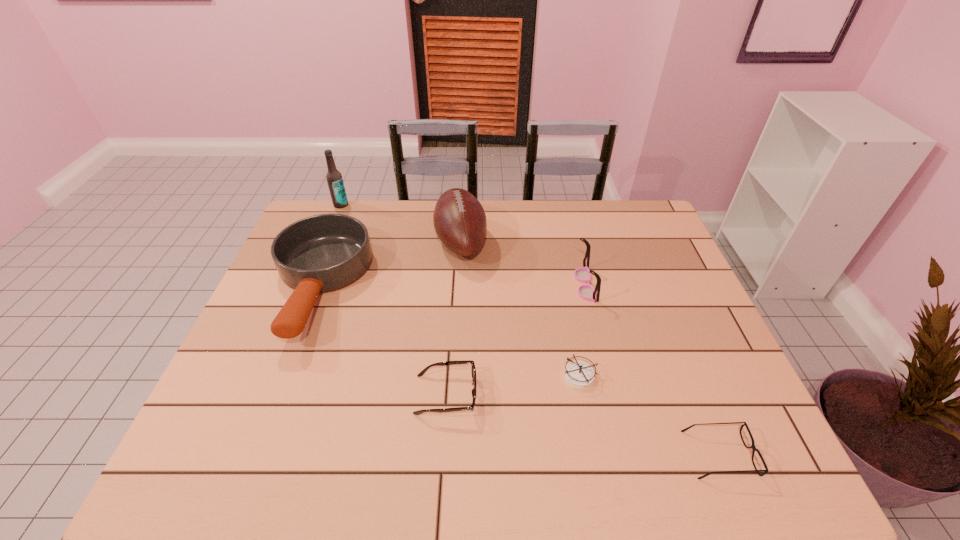
The image size is (960, 540). Find the location of `vacant space at the near edge`. vacant space at the near edge is located at coordinates point(310,449).

Find the location of `vacant area at the right edge of the desktop`. vacant area at the right edge of the desktop is located at coordinates (712, 426).

In the image, there is a desktop. Where is `vacant space at the near left corner`? vacant space at the near left corner is located at coordinates (232, 453).

At what (x,y) coordinates should I click in order to perform the action: click on vacant space at the far right corner of the desktop. Please return your answer as a coordinate pair (x, y). The image size is (960, 540). Looking at the image, I should click on (636, 221).

Find the location of a particular element. free space between the second tallest object and the tallest object is located at coordinates (400, 223).

This screenshot has height=540, width=960. I want to click on unoccupied area between the compass and the leftmost spectacles, so click(x=513, y=386).

Locate an element on the screen. The width and height of the screenshot is (960, 540). empty space between the rightmost spectacles and the football (American) is located at coordinates (589, 348).

Locate an element on the screen. The width and height of the screenshot is (960, 540). unoccupied area between the pan and the shortest spectacles is located at coordinates point(518,371).

Where is `vacant region between the pan and the leftmost spectacles`? The width and height of the screenshot is (960, 540). vacant region between the pan and the leftmost spectacles is located at coordinates (382, 341).

Where is `blank region between the fourth tallest object and the farthest spectacles`? Image resolution: width=960 pixels, height=540 pixels. blank region between the fourth tallest object and the farthest spectacles is located at coordinates (452, 286).